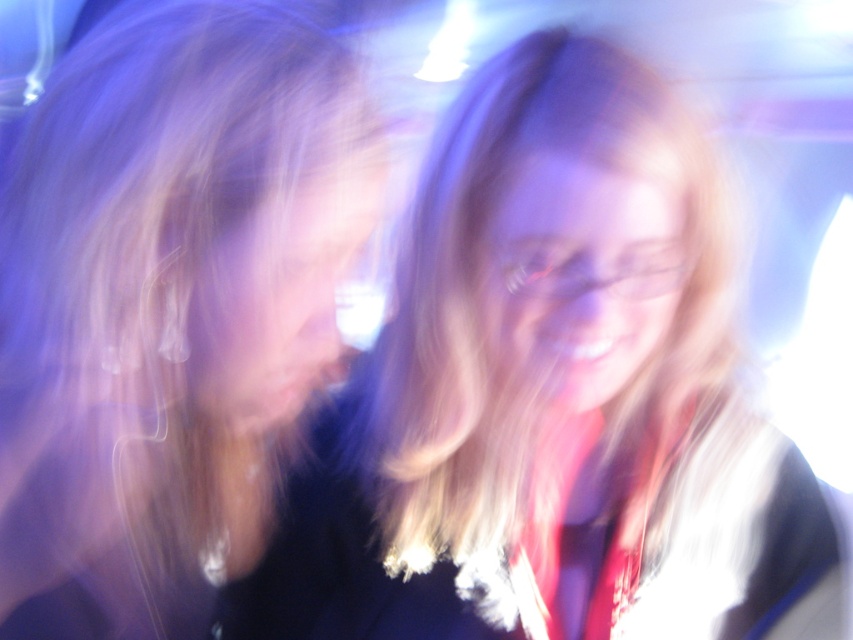
Question: Is blonde hair at center positioned before blonde hair at left?

Choices:
 (A) no
 (B) yes

Answer: (B)

Question: Does blonde hair at center come in front of blonde hair at left?

Choices:
 (A) yes
 (B) no

Answer: (A)

Question: Which of the following is the closest to the observer?

Choices:
 (A) (9, 460)
 (B) (619, 307)

Answer: (B)

Question: Is blonde hair at center to the left of blonde hair at left from the viewer's perspective?

Choices:
 (A) no
 (B) yes

Answer: (A)

Question: Which point appears farthest from the camera in this image?

Choices:
 (A) (563, 378)
 (B) (352, 216)

Answer: (A)